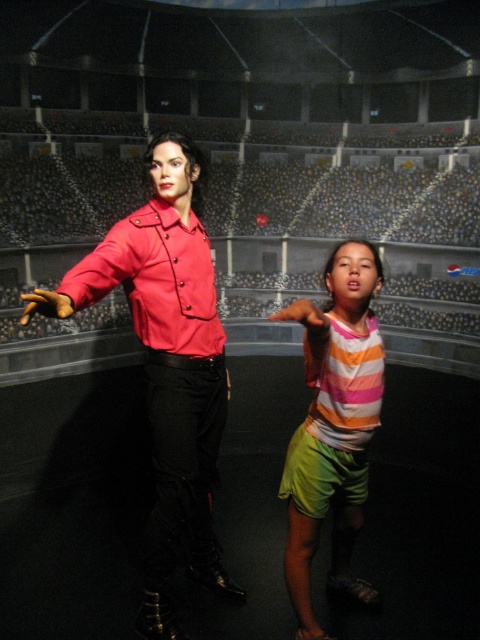
You are a museum security guard who needs to ensure that the matte red jacket at left and the striped cotton shirt at center are displayed properly. According to the museum guidelines, larger items must be placed on higher shelves. Which item should be placed on a higher shelf?

The matte red jacket at left has a larger size compared to the striped cotton shirt at center, so it should be placed on a higher shelf as per the museum guidelines.

In the image, there is a point at coordinates (167, 364). Which object from the scene does this point belong to?

The point at coordinates (167, 364) belongs to the matte red jacket at left.